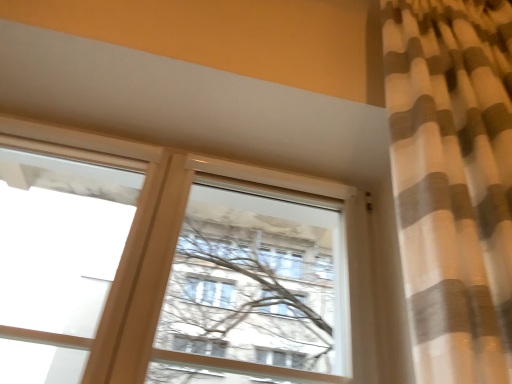
Question: Is transparent glass window at upper left, the second window from the right, to the right of white matte window at center, arranged as the first window when viewed from the right, from the viewer's perspective?

Choices:
 (A) yes
 (B) no

Answer: (B)

Question: Is transparent glass window at upper left, the second window from the right, positioned in front of white matte window at center, arranged as the first window when viewed from the right?

Choices:
 (A) no
 (B) yes

Answer: (B)

Question: From the image's perspective, is transparent glass window at upper left, the second window from the right, located beneath white matte window at center, which is counted as the second window, starting from the left?

Choices:
 (A) no
 (B) yes

Answer: (A)

Question: Is white matte window at center, which is counted as the second window, starting from the left, at the back of transparent glass window at upper left, the second window from the right?

Choices:
 (A) no
 (B) yes

Answer: (A)

Question: From a real-world perspective, is transparent glass window at upper left, the second window from the right, physically below white matte window at center, arranged as the first window when viewed from the right?

Choices:
 (A) yes
 (B) no

Answer: (A)

Question: Considering the relative sizes of transparent glass window at upper left, the second window from the right, and white matte window at center, which is counted as the second window, starting from the left, in the image provided, is transparent glass window at upper left, the second window from the right, bigger than white matte window at center, which is counted as the second window, starting from the left,?

Choices:
 (A) yes
 (B) no

Answer: (B)

Question: Does white matte window at center, arranged as the first window when viewed from the right, turn towards transparent glass window at upper left, which is the 1th window in left-to-right order?

Choices:
 (A) no
 (B) yes

Answer: (A)

Question: Is white matte window at center, which is counted as the second window, starting from the left, further to camera compared to transparent glass window at upper left, the second window from the right?

Choices:
 (A) yes
 (B) no

Answer: (A)

Question: Considering the relative sizes of white matte window at center, which is counted as the second window, starting from the left, and transparent glass window at upper left, the second window from the right, in the image provided, is white matte window at center, which is counted as the second window, starting from the left, smaller than transparent glass window at upper left, the second window from the right,?

Choices:
 (A) no
 (B) yes

Answer: (A)

Question: Is the position of white matte window at center, arranged as the first window when viewed from the right, less distant than that of transparent glass window at upper left, which is the 1th window in left-to-right order?

Choices:
 (A) yes
 (B) no

Answer: (B)

Question: Is white matte window at center, arranged as the first window when viewed from the right, shorter than transparent glass window at upper left, which is the 1th window in left-to-right order?

Choices:
 (A) yes
 (B) no

Answer: (A)

Question: From a real-world perspective, is white matte window at center, arranged as the first window when viewed from the right, physically below transparent glass window at upper left, which is the 1th window in left-to-right order?

Choices:
 (A) no
 (B) yes

Answer: (A)

Question: Based on their sizes in the image, would you say white matte window at center, arranged as the first window when viewed from the right, is bigger or smaller than transparent glass window at upper left, which is the 1th window in left-to-right order?

Choices:
 (A) small
 (B) big

Answer: (B)